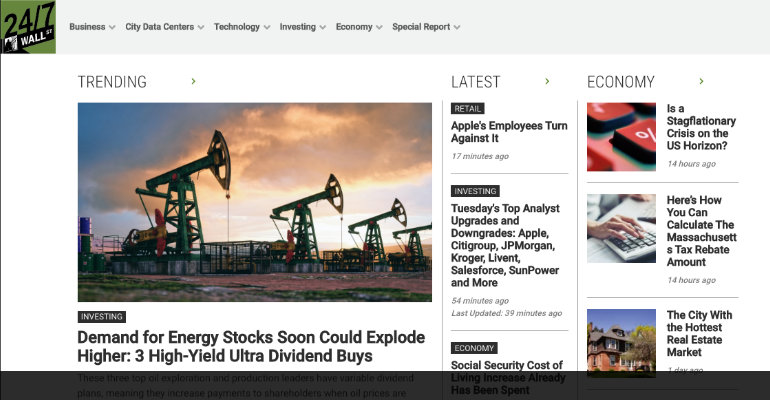
Locate an element on the screen. Image resolution: width=770 pixels, height=400 pixels. calculator buttons is located at coordinates tap(640, 132), tap(610, 118).